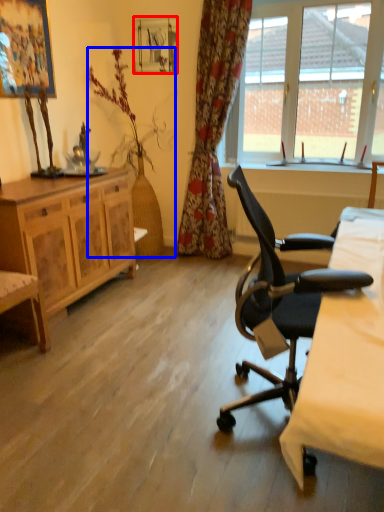
Question: Which of the following is the farthest to the observer, picture frame (highlighted by a red box) or houseplant (highlighted by a blue box)?

Choices:
 (A) picture frame
 (B) houseplant

Answer: (A)